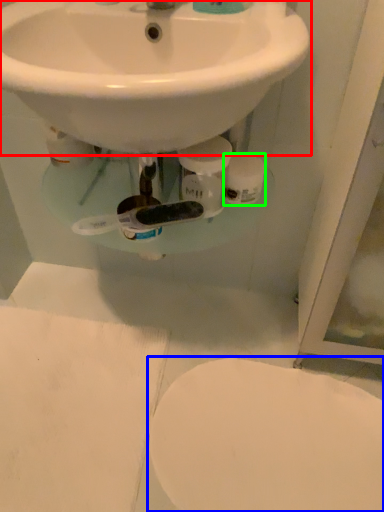
Question: Which object is the farthest from sink (highlighted by a red box)? Choose among these: toilet (highlighted by a blue box) or toilet paper (highlighted by a green box).

Choices:
 (A) toilet
 (B) toilet paper

Answer: (A)